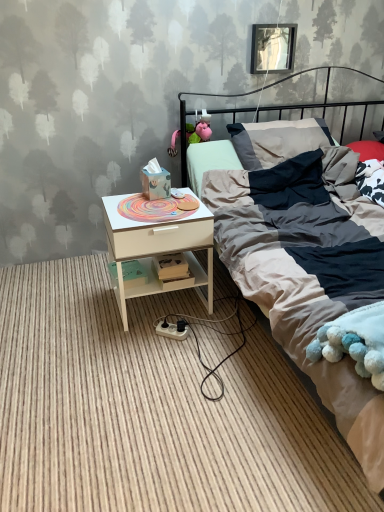
The height and width of the screenshot is (512, 384). Find the location of `free space to the left of white wood nightstand at lower left`. free space to the left of white wood nightstand at lower left is located at coordinates (78, 307).